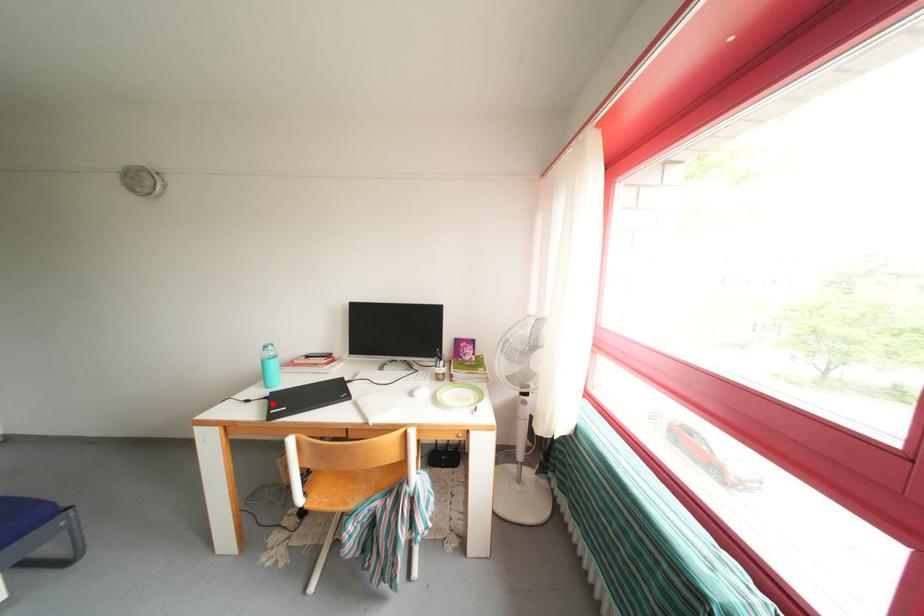
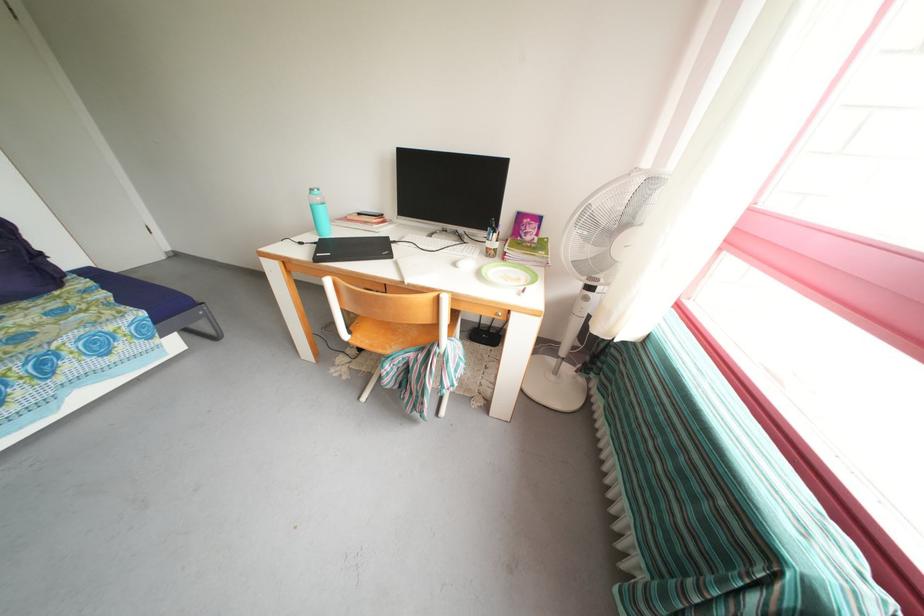
Question: I am providing you with two images of the same scene from different viewpoints. A red point is marked on the first image. Is the red point's position out of view in image 2?

Choices:
 (A) Yes
 (B) No

Answer: (B)